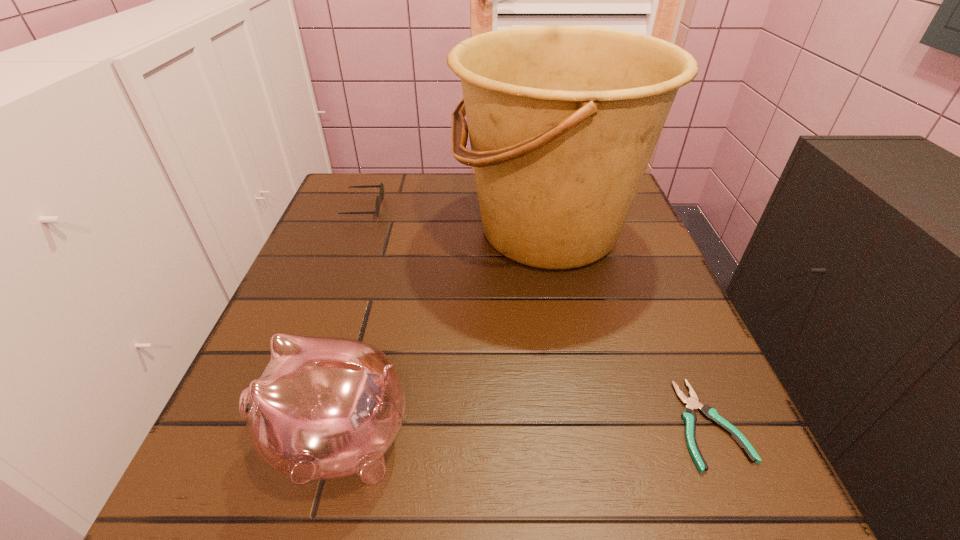
Where is `object that is at the far right corner`? The image size is (960, 540). object that is at the far right corner is located at coordinates (563, 120).

Image resolution: width=960 pixels, height=540 pixels. I want to click on object at the near right corner, so click(692, 403).

Where is `vacant region at the far edge of the desktop`? vacant region at the far edge of the desktop is located at coordinates (393, 222).

Identify the location of vacant point at the near edge. This screenshot has height=540, width=960. (504, 510).

What are the coordinates of `vacant space at the left edge of the desktop` in the screenshot? It's located at [345, 332].

What are the coordinates of `free region at the right edge of the desktop` in the screenshot? It's located at (688, 396).

Where is `free region at the far left corner of the desktop`? The width and height of the screenshot is (960, 540). free region at the far left corner of the desktop is located at coordinates (349, 188).

Locate an element on the screen. vacant space at the near right corner of the desktop is located at coordinates (649, 457).

Locate an element on the screen. The image size is (960, 540). vacant area that lies between the piggy bank and the sunglasses is located at coordinates (351, 324).

The image size is (960, 540). Find the location of `vacant space in between the piggy bank and the bucket`. vacant space in between the piggy bank and the bucket is located at coordinates (444, 336).